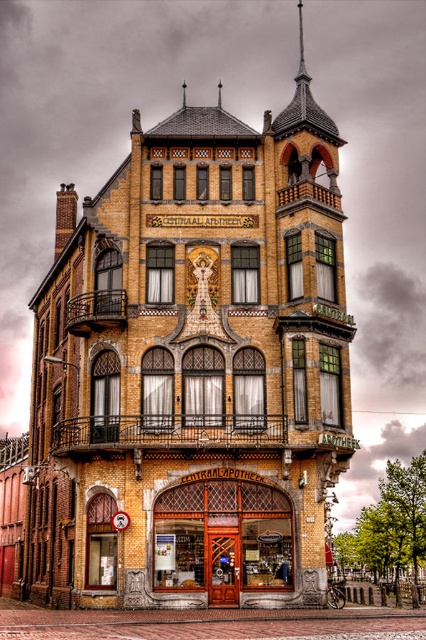
You are a visitor approaching the building and want to enter through the wooden door at center. When you open the door, will you see the metallic clock face at center immediately?

The metallic clock face at center is behind the wooden door at center, so when you open the wooden door at center, you will see the metallic clock face at center immediately.

You are a delivery person standing at point (221, 536) in the image. You need to deliver a package to the wooden door at center. Is there any obstacle between your current position and the wooden door at center?

The wooden door at center is located at point (221, 536), which is your current position. There are no obstacles between you and the door since you are already at the same location.